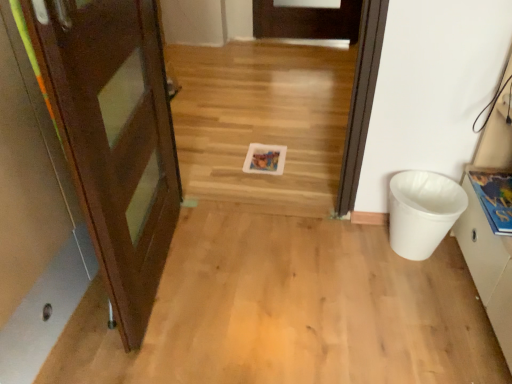
Question: Can you confirm if matte brown door at left is positioned to the right of white matte cabinet at right?

Choices:
 (A) no
 (B) yes

Answer: (A)

Question: Does matte brown door at left turn towards white matte cabinet at right?

Choices:
 (A) yes
 (B) no

Answer: (B)

Question: Considering the relative sizes of matte brown door at left and white matte cabinet at right in the image provided, is matte brown door at left thinner than white matte cabinet at right?

Choices:
 (A) no
 (B) yes

Answer: (A)

Question: Is matte brown door at left positioned in front of white matte cabinet at right?

Choices:
 (A) no
 (B) yes

Answer: (A)

Question: Does matte brown door at left lie behind white matte cabinet at right?

Choices:
 (A) no
 (B) yes

Answer: (B)

Question: Can you confirm if matte brown door at left is shorter than white matte cabinet at right?

Choices:
 (A) yes
 (B) no

Answer: (B)

Question: Can you confirm if matte brown door at left is thinner than white plastic trash can at right?

Choices:
 (A) yes
 (B) no

Answer: (B)

Question: Considering the relative sizes of matte brown door at left and white plastic trash can at right in the image provided, is matte brown door at left smaller than white plastic trash can at right?

Choices:
 (A) no
 (B) yes

Answer: (A)

Question: Would you say matte brown door at left is a long distance from white plastic trash can at right?

Choices:
 (A) yes
 (B) no

Answer: (B)

Question: Is matte brown door at left to the left of white plastic trash can at right from the viewer's perspective?

Choices:
 (A) yes
 (B) no

Answer: (A)

Question: Is matte brown door at left bigger than white plastic trash can at right?

Choices:
 (A) no
 (B) yes

Answer: (B)

Question: Does matte brown door at left lie behind white plastic trash can at right?

Choices:
 (A) no
 (B) yes

Answer: (A)

Question: Is white plastic trash can at right positioned far away from white matte cabinet at right?

Choices:
 (A) yes
 (B) no

Answer: (B)